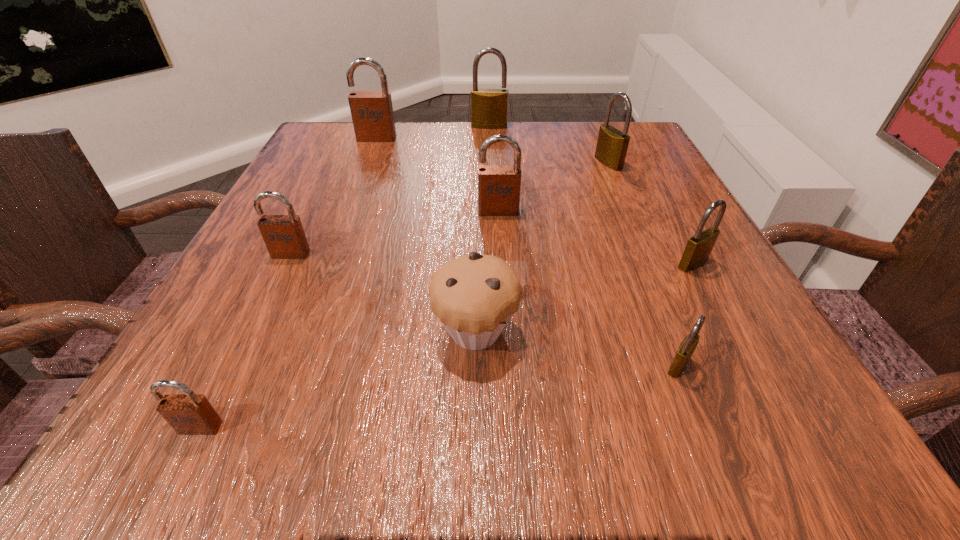
The width and height of the screenshot is (960, 540). What are the coordinates of `the rightmost brass padlock` in the screenshot? It's located at (698, 249).

This screenshot has width=960, height=540. I want to click on muffin, so click(x=474, y=296).

Image resolution: width=960 pixels, height=540 pixels. I want to click on the smallest brass padlock, so click(687, 347).

The image size is (960, 540). Identify the location of the nearest brass padlock. (687, 347).

In order to click on the nearest padlock in this screenshot , I will do `click(188, 414)`.

In order to click on the smallest brown padlock in this screenshot , I will do `click(188, 414)`.

Where is `free region located on the front of the biggest brass padlock`? free region located on the front of the biggest brass padlock is located at coordinates (491, 176).

Find the location of a particular element. The image size is (960, 540). vacant position located on the front-facing side of the second farthest object is located at coordinates (346, 221).

Find the location of a particular element. free space located on the right of the third farthest padlock is located at coordinates 648,163.

You are a GUI agent. You are given a task and a screenshot of the screen. Output one action in this format:
    pyautogui.click(x=<x>, y=<y>)
    Task: Click on the free space located 0.070m on the front-facing side of the rightmost brown padlock
    The image size is (960, 540).
    Given the screenshot: What is the action you would take?
    pyautogui.click(x=500, y=240)